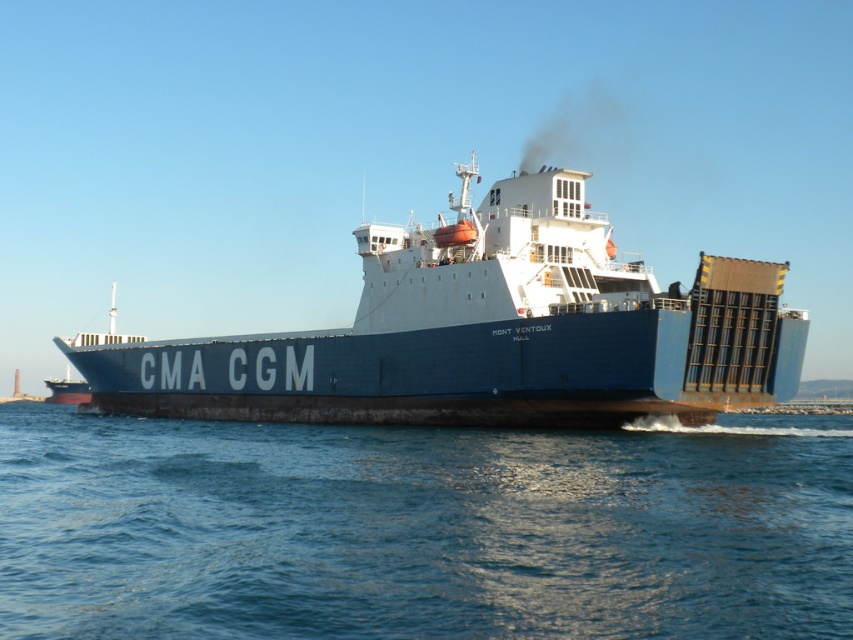
Is blue water at center positioned behind blue matte container ship at center?

No, it is in front of blue matte container ship at center.

Does blue water at center have a lesser width compared to blue matte container ship at center?

Indeed, blue water at center has a lesser width compared to blue matte container ship at center.

Is point (531, 608) closer to viewer compared to point (505, 372)?

Yes, it is in front of point (505, 372).

This screenshot has width=853, height=640. I want to click on blue water at center, so click(422, 529).